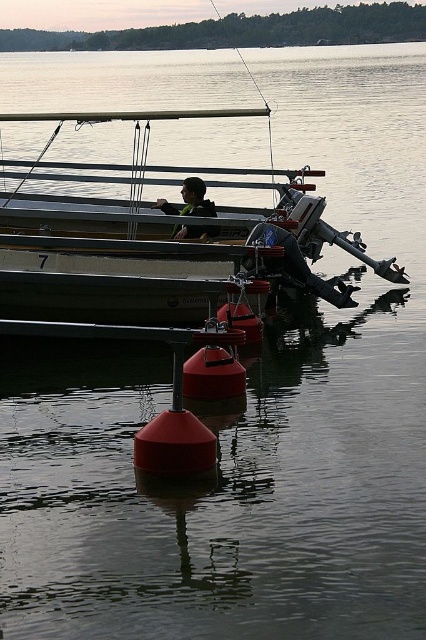
You are planning to store the matte black jacket at center on the white matte boat at center. Based on their sizes, will the jacket fit comfortably on the boat?

The white matte boat at center is larger in size than the matte black jacket at center, so the jacket will fit comfortably on the boat.

You are planning to store the matte black jacket at center in the white matte boat at center. Based on their sizes, will the jacket fit inside the boat?

The white matte boat at center is wider than the matte black jacket at center, so the jacket should fit inside the boat.

You are standing on the wooden pier and see the white matte boat at center and the matte black jacket at center. Which object is positioned higher relative to the other?

The white matte boat at center is above the matte black jacket at center.